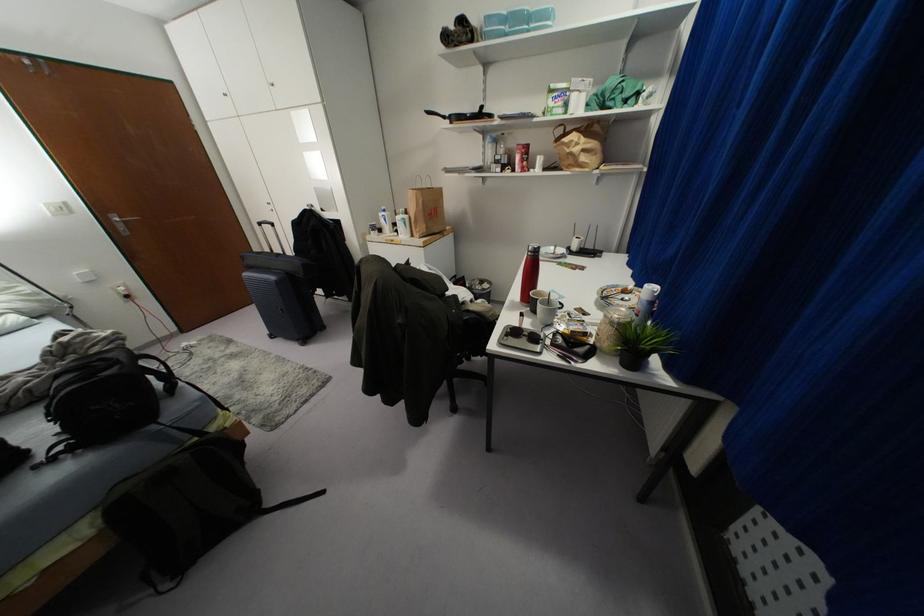
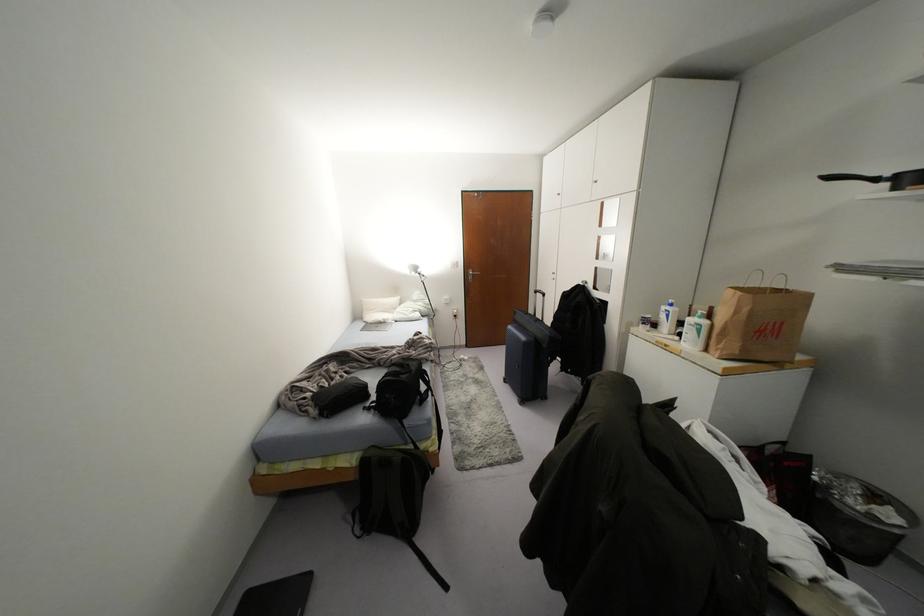
The point at (65,208) is marked in the first image. Where is the corresponding point in the second image?

(456, 264)